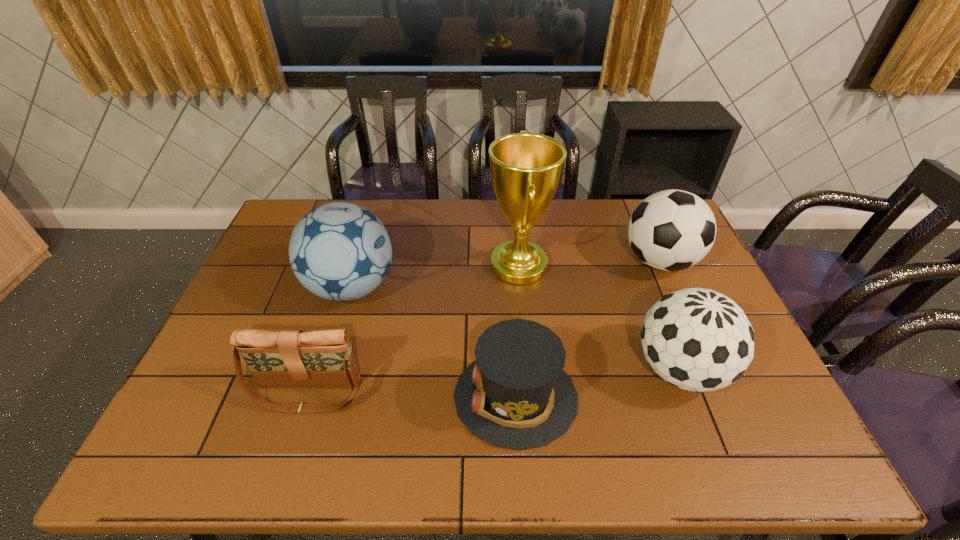
Where is `the tallest object`? the tallest object is located at coordinates (526, 168).

Identify the location of the leftmost soccer ball. (339, 251).

I want to click on the nearest soccer ball, so click(697, 339).

The height and width of the screenshot is (540, 960). Find the location of `shoulder bag`. shoulder bag is located at coordinates (287, 358).

Where is `dress hat`? dress hat is located at coordinates (516, 395).

Locate an element on the screen. This screenshot has height=540, width=960. vacant region located 0.090m by the handles of the award is located at coordinates (460, 265).

I want to click on vacant area situated 0.300m by the handles of the award, so click(396, 265).

In order to click on vacant area situated by the handles of the award in this screenshot , I will do `click(435, 265)`.

Locate an element on the screen. Image resolution: width=960 pixels, height=540 pixels. vacant space located on the side with brand of the leftmost soccer ball is located at coordinates (462, 287).

I want to click on vacant area located 0.060m on the front of the nearest soccer ball, so click(x=705, y=436).